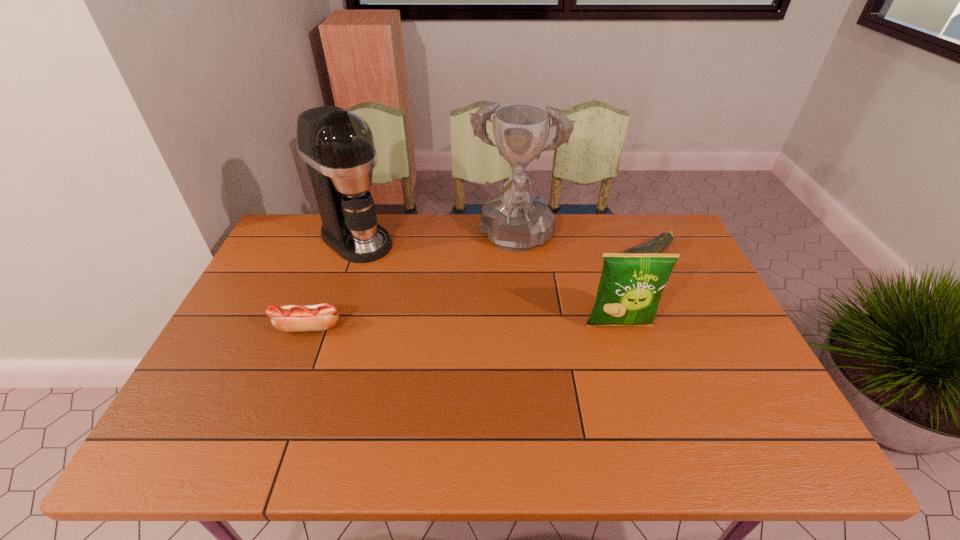
At what (x,y) coordinates should I click in order to perform the action: click on blank space at the far right corner of the desktop. Please return your answer as a coordinate pair (x, y). This screenshot has height=540, width=960. Looking at the image, I should click on (649, 240).

Identify the location of empty space between the third tallest object and the sausage. (464, 326).

This screenshot has width=960, height=540. I want to click on free space between the coffee maker and the third shortest object, so click(488, 282).

What are the coordinates of `vacant region between the coffee maker and the third object from left to right` in the screenshot? It's located at (436, 240).

You are a GUI agent. You are given a task and a screenshot of the screen. Output one action in this format:
    pyautogui.click(x=<x>, y=<y>)
    Task: Click on the free space between the sausage and the coffee maker
    
    Given the screenshot: What is the action you would take?
    pyautogui.click(x=332, y=283)

Where is `free space between the coffee maker and the third tallest object`? The width and height of the screenshot is (960, 540). free space between the coffee maker and the third tallest object is located at coordinates (488, 282).

Where is `blank region between the zucchini and the award`? The image size is (960, 540). blank region between the zucchini and the award is located at coordinates (580, 249).

You are a GUI agent. You are given a task and a screenshot of the screen. Output one action in this format:
    pyautogui.click(x=<x>, y=<y>)
    Task: Click on the vacant space in between the zucchini and the sausage
    The width and height of the screenshot is (960, 540).
    Given the screenshot: What is the action you would take?
    pyautogui.click(x=477, y=293)

Identify which object is the fourth nearest to the coffee maker. Please provide its 2D coordinates. Your answer should be formatted as a tuple, i.e. [(x, y)], where the tuple contains the x and y coordinates of a point satisfying the conditions above.

[(657, 245)]

Identify which object is the nearest to the sausage. Please provide its 2D coordinates. Your answer should be formatted as a tuple, i.e. [(x, y)], where the tuple contains the x and y coordinates of a point satisfying the conditions above.

[(337, 145)]